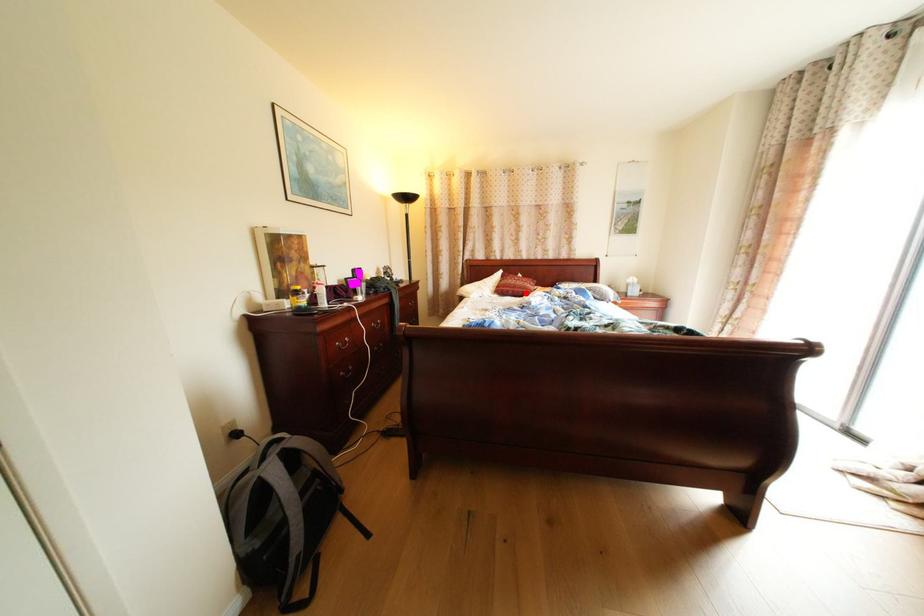
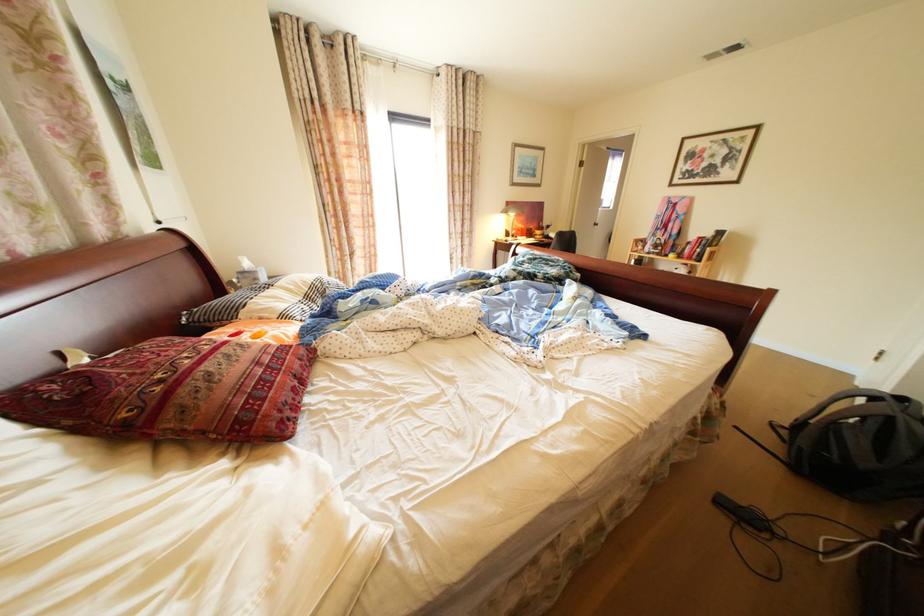
Where in the second image is the point corresponding to the highlighted location from the first image?

(309, 378)